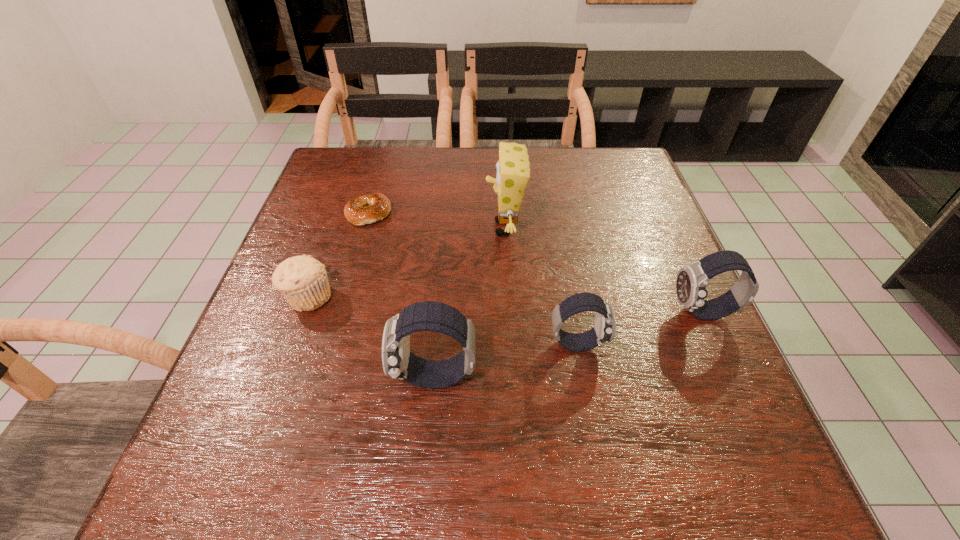
Considering the uniform spacing of watchs, where should an additional watch be positioned on the left? Please locate a free spot. Please provide its 2D coordinates. Your answer should be formatted as a tuple, i.e. [(x, y)], where the tuple contains the x and y coordinates of a point satisfying the conditions above.

[(272, 416)]